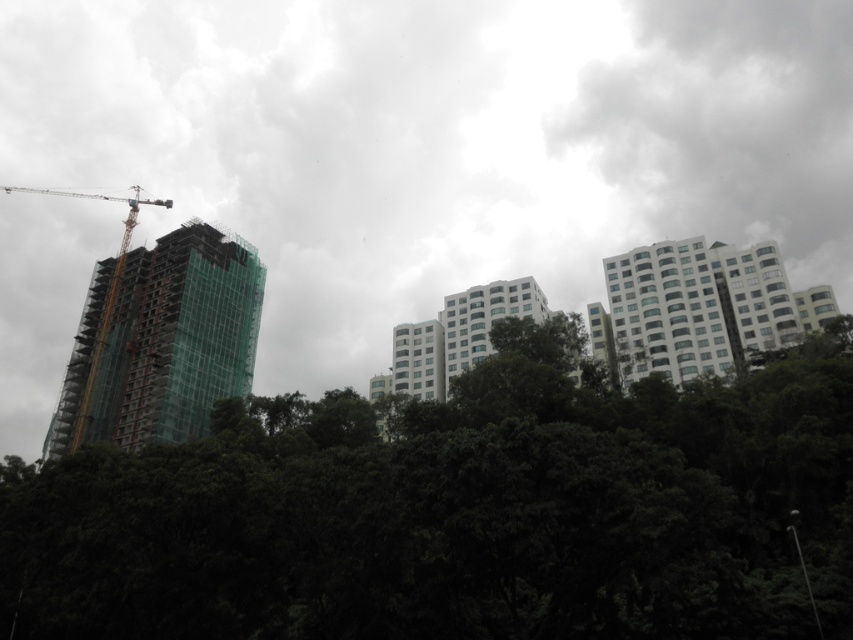
Question: Which object is closer to the camera taking this photo?

Choices:
 (A) green glass building at left
 (B) transparent glass building at upper left
 (C) green leafy trees at center

Answer: (C)

Question: Which point is closer to the camera?

Choices:
 (A) (125, 244)
 (B) (688, 449)
 (C) (10, 220)
 (D) (151, 397)

Answer: (B)

Question: Which point is farther to the camera?

Choices:
 (A) yellow metal crane at left
 (B) white glossy building at upper right
 (C) transparent glass building at upper left

Answer: (A)

Question: Can you confirm if transparent glass building at upper left is positioned below green glass building at left?

Choices:
 (A) yes
 (B) no

Answer: (B)

Question: Is transparent glass building at upper left below yellow metal crane at left?

Choices:
 (A) yes
 (B) no

Answer: (B)

Question: Can you confirm if green leafy trees at center is positioned below yellow metal crane at left?

Choices:
 (A) no
 (B) yes

Answer: (B)